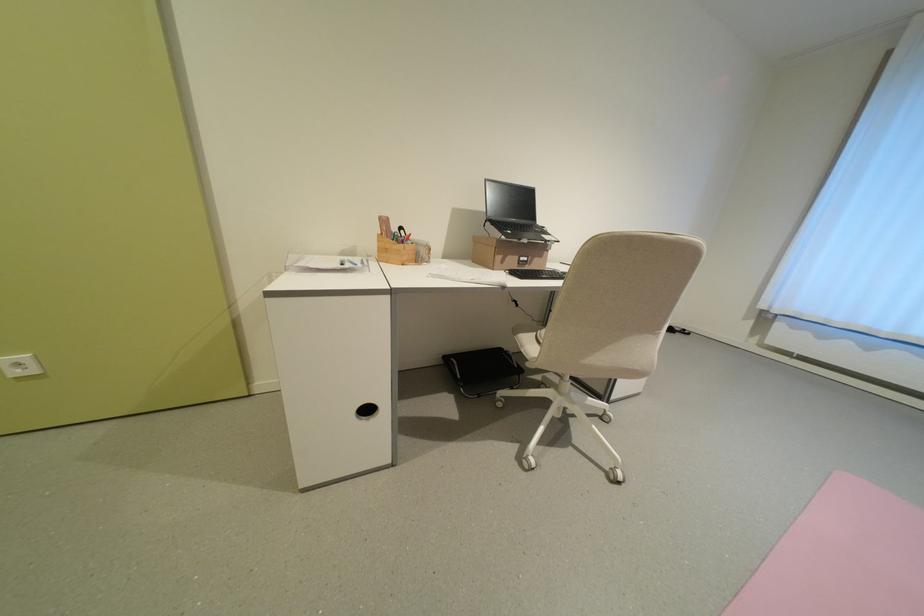
Find where to clos the black laptop. Please return your answer as a coordinate pair (x, y).

(514, 211)